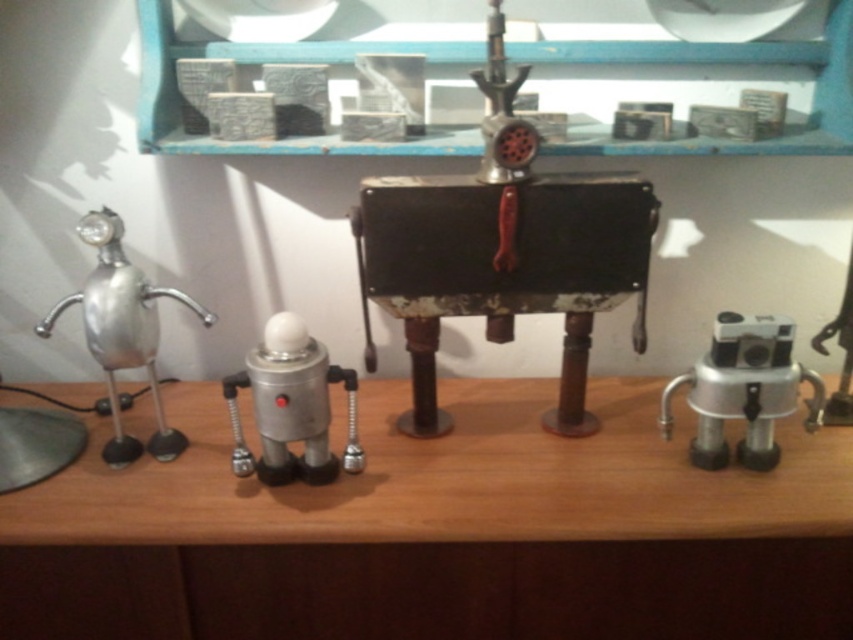
You are a delivery person who needs to place a new package on the shelf. The package is 8 inches wide. Can you fit it between the rusty metal meat grinder at center and the metallic gray blocks at upper center without moving any existing items?

The rusty metal meat grinder at center is 7.69 inches away from the metallic gray blocks at upper center. Since the package is 8 inches wide, it cannot fit between them as the available space is slightly smaller than the package.

You are standing in front of a wooden shelf displaying metallic objects. There is a point at coordinates (x=492, y=212) on the shelf. If you want to place a small metallic robot figurine from the left side of the shelf onto this point, will you need to move closer to the shelf or stay at your current distance?

The point at coordinates (x=492, y=212) is 3.38 feet from the viewer. Since the robot figurine is on the left side of the shelf, which is part of the same shelf structure, you can reach it without needing to move closer. However, the exact distance might require checking if your current position allows reaching 3.38 feet. If you are already at that distance, no adjustment is needed.

You are a delivery person who needs to place a package that is 3 feet long on the wooden shelf. The package must be placed between the wooden table at center and the camera. Is there enough space between them to fit the package?

The wooden table at center and the camera are 37.65 inches apart. Since 3 feet is equal to 36 inches, the space between them is sufficient to fit the package as 37.65 inches is greater than 36 inches.